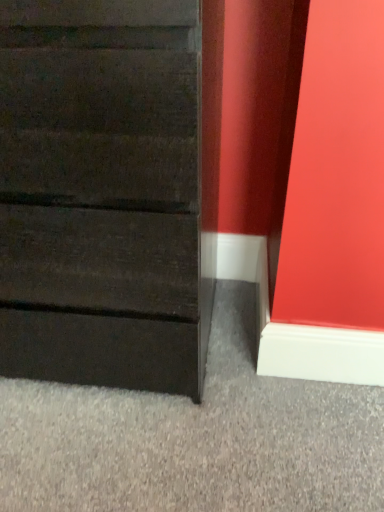
You are a GUI agent. You are given a task and a screenshot of the screen. Output one action in this format:
    pyautogui.click(x=<x>, y=<y>)
    Task: Click on the dark wood chest of drawers at center
    The height and width of the screenshot is (512, 384).
    Given the screenshot: What is the action you would take?
    pyautogui.click(x=108, y=191)

This screenshot has height=512, width=384. Describe the element at coordinates (108, 191) in the screenshot. I see `dark wood chest of drawers at center` at that location.

I want to click on dark wood chest of drawers at center, so click(x=108, y=191).